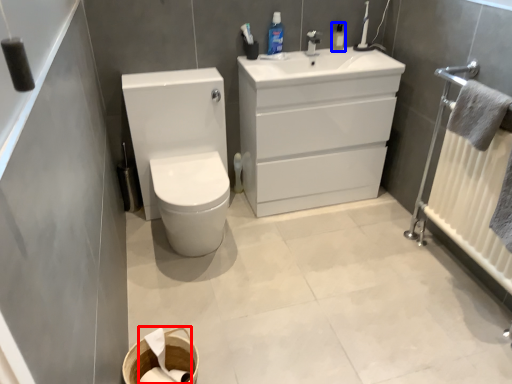
Question: Among these objects, which one is farthest to the camera, toilet paper (highlighted by a red box) or mouthwash (highlighted by a blue box)?

Choices:
 (A) toilet paper
 (B) mouthwash

Answer: (B)